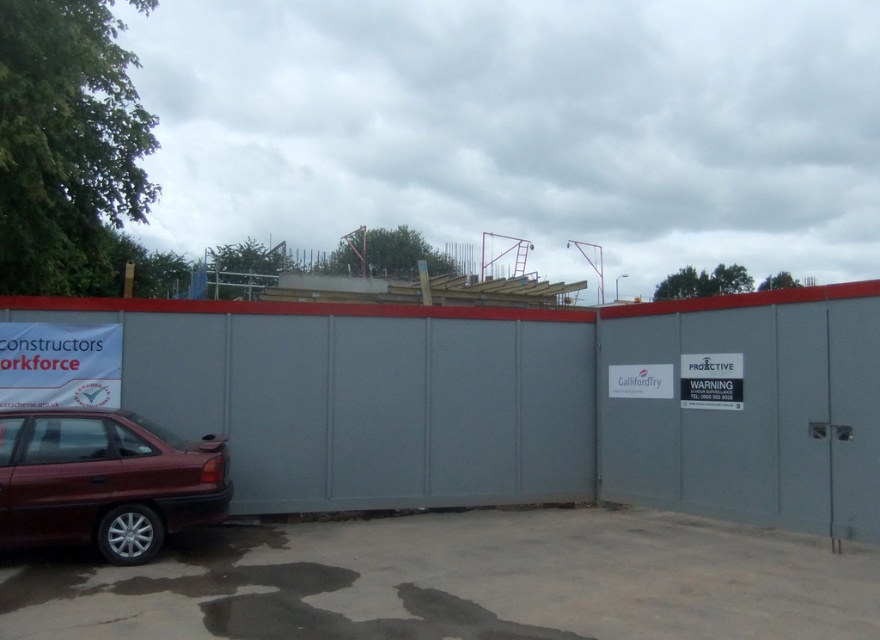
Is point (132, 422) positioned in front of point (67, 372)?

Yes, it is in front of point (67, 372).

Can you confirm if maroon metallic car at lower left is shorter than white paper sign at left?

In fact, maroon metallic car at lower left may be taller than white paper sign at left.

Where is `maroon metallic car at lower left`? The height and width of the screenshot is (640, 880). maroon metallic car at lower left is located at coordinates (104, 481).

Is point (28, 316) behind point (0, 392)?

Yes, point (28, 316) is behind point (0, 392).

Who is higher up, gray matte fence at center or white paper sign at left?

gray matte fence at center

Who is more forward, (379,344) or (85,364)?

Point (85,364) is in front.

Identify the location of gray matte fence at center. (519, 401).

Is gray matte fence at center closer to camera compared to maroon metallic car at lower left?

No, it is not.

Is point (713, 412) closer to viewer compared to point (129, 472)?

No, it is not.

Who is more forward, (670, 342) or (61, 454)?

Point (61, 454) is in front.

Locate an element on the screen. gray matte fence at center is located at coordinates (519, 401).